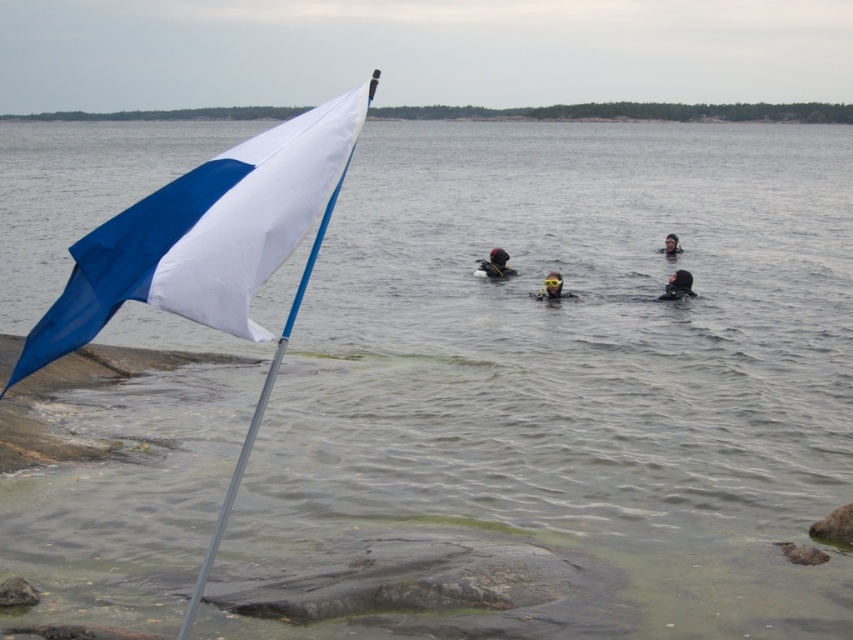
Between point (486, 272) and point (670, 296), which one is positioned behind?

Positioned behind is point (486, 272).

Between matte black wetsuit at center and black rubber wetsuit at center, which one is positioned higher?

matte black wetsuit at center is above.

The width and height of the screenshot is (853, 640). What do you see at coordinates (495, 264) in the screenshot?
I see `matte black wetsuit at center` at bounding box center [495, 264].

At what (x,y) coordinates should I click in order to perform the action: click on matte black wetsuit at center. Please return your answer as a coordinate pair (x, y). The width and height of the screenshot is (853, 640). Looking at the image, I should click on (495, 264).

Is point (329, 164) in front of point (494, 250)?

Yes, it is in front of point (494, 250).

Can you confirm if blue fabric flag at left is positioned below matte black wetsuit at center?

Actually, blue fabric flag at left is above matte black wetsuit at center.

This screenshot has height=640, width=853. What are the coordinates of `blue fabric flag at left` in the screenshot? It's located at (207, 234).

Is blue fabric flag at left taller than black rubber wetsuit at center?

Indeed, blue fabric flag at left has a greater height compared to black rubber wetsuit at center.

Between point (245, 202) and point (674, 282), which one is positioned in front?

Point (245, 202)

Who is more distant from viewer, (115, 301) or (683, 289)?

The point (683, 289) is more distant.

The height and width of the screenshot is (640, 853). I want to click on blue fabric flag at left, so click(207, 234).